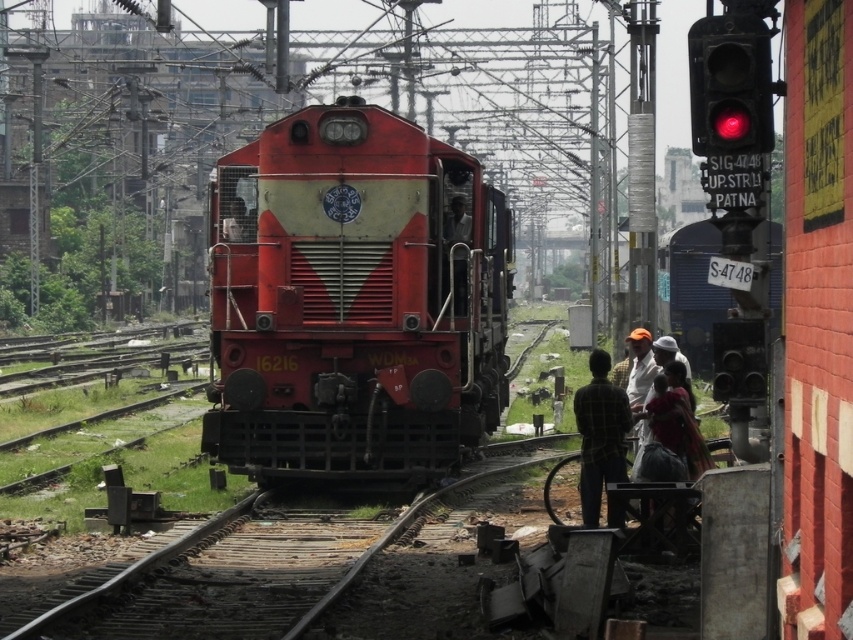
You are a train conductor preparing to depart from the station. You notice a red glass traffic light at upper right and a matte black face at center. Which object is located above the other?

The red glass traffic light at upper right is positioned over matte black face at center.

Based on the photo, you are a train engineer trying to navigate through the railway junction. There is a red glass traffic light at upper right. Can you estimate its location in terms of coordinates?

The red glass traffic light at upper right is located at coordinates point (730, 84).

You are standing at the point marked by the coordinates (352, 300) in the railway scene. What object are you directly at?

The point marked by the coordinates (352, 300) corresponds to the matte red locomotive at center.